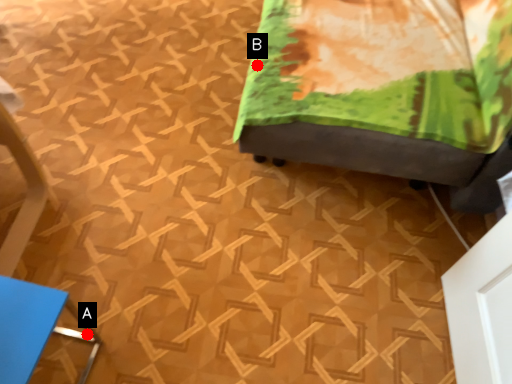
Question: Two points are circled on the image, labeled by A and B beside each circle. Which of the following is the farthest from the observer?

Choices:
 (A) A is further
 (B) B is further

Answer: (B)